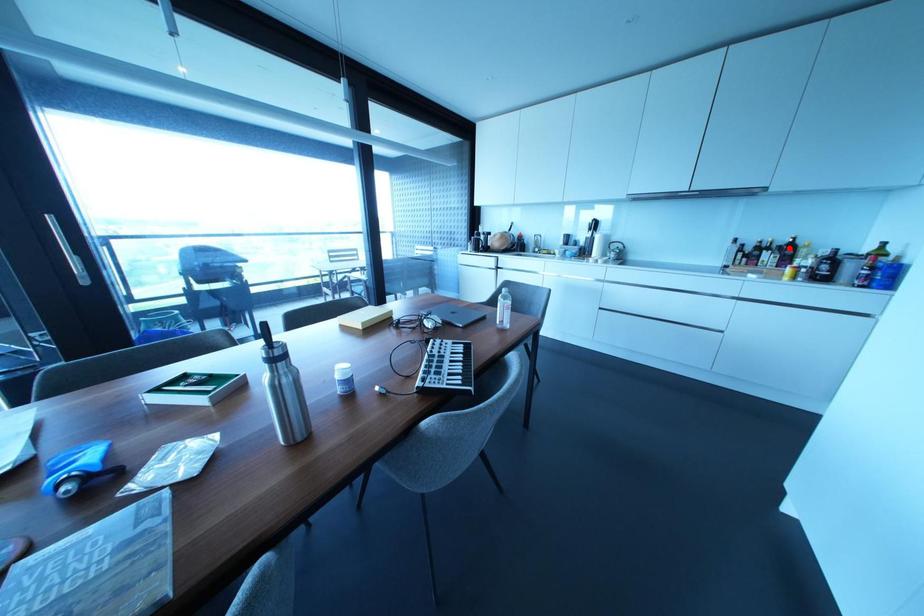
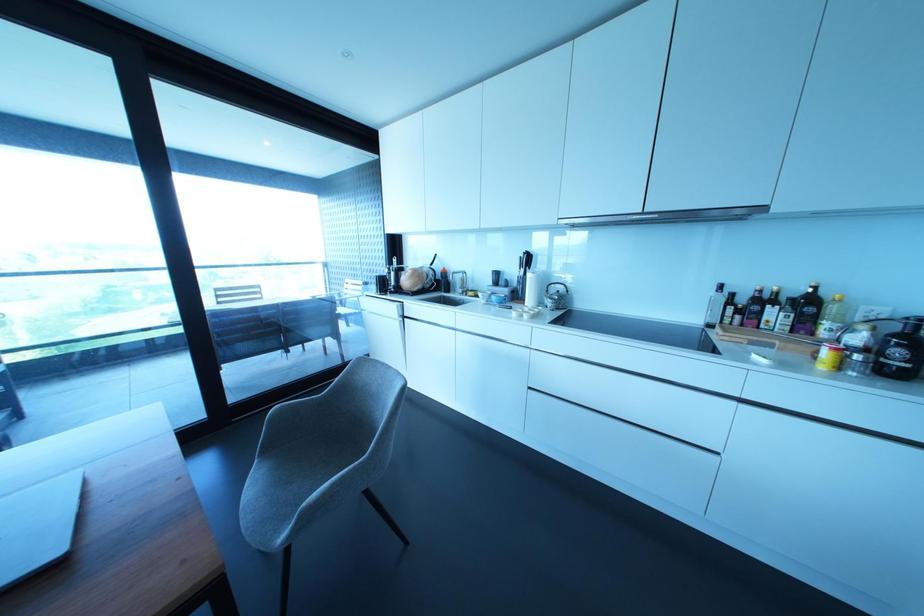
In the second image, find the point that corresponds to the highlighted location in the first image.

(807, 304)